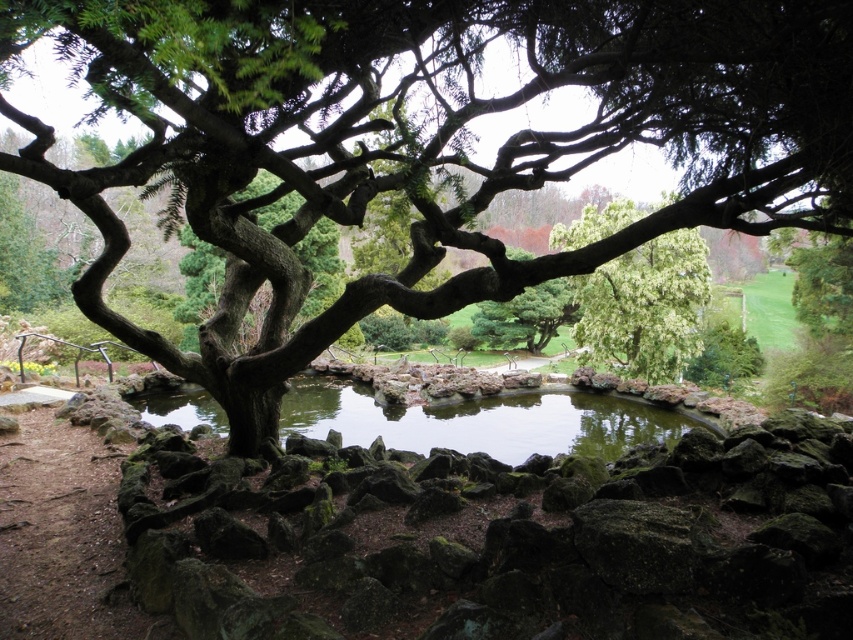
Can you confirm if clear water at center is smaller than green leafy tree at center?

Actually, clear water at center might be larger than green leafy tree at center.

Locate an element on the screen. The height and width of the screenshot is (640, 853). clear water at center is located at coordinates (482, 420).

Which is behind, point (637, 410) or point (589, 352)?

Point (589, 352)

Identify the location of clear water at center. The width and height of the screenshot is (853, 640). (482, 420).

Does green textured tree at center appear on the right side of green leafy tree at center?

No, green textured tree at center is not to the right of green leafy tree at center.

Is green textured tree at center below green leafy tree at center?

Correct, green textured tree at center is located below green leafy tree at center.

Where is `green textured tree at center`? The width and height of the screenshot is (853, 640). green textured tree at center is located at coordinates (427, 140).

Locate an element on the screen. Image resolution: width=853 pixels, height=640 pixels. green textured tree at center is located at coordinates (427, 140).

Does green textured tree at center appear over clear water at center?

Correct, green textured tree at center is located above clear water at center.

Does point (310, 198) lie behind point (346, 397)?

No, it is not.

Describe the element at coordinates (427, 140) in the screenshot. I see `green textured tree at center` at that location.

Locate an element on the screen. The image size is (853, 640). green textured tree at center is located at coordinates click(x=427, y=140).